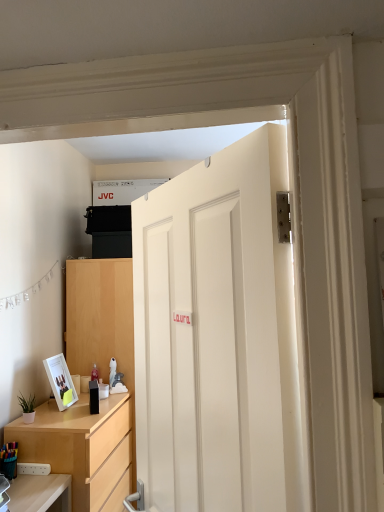
This screenshot has height=512, width=384. In order to click on vacant area that is situated to the right of white glossy picture frame at lower left in this screenshot , I will do `click(78, 406)`.